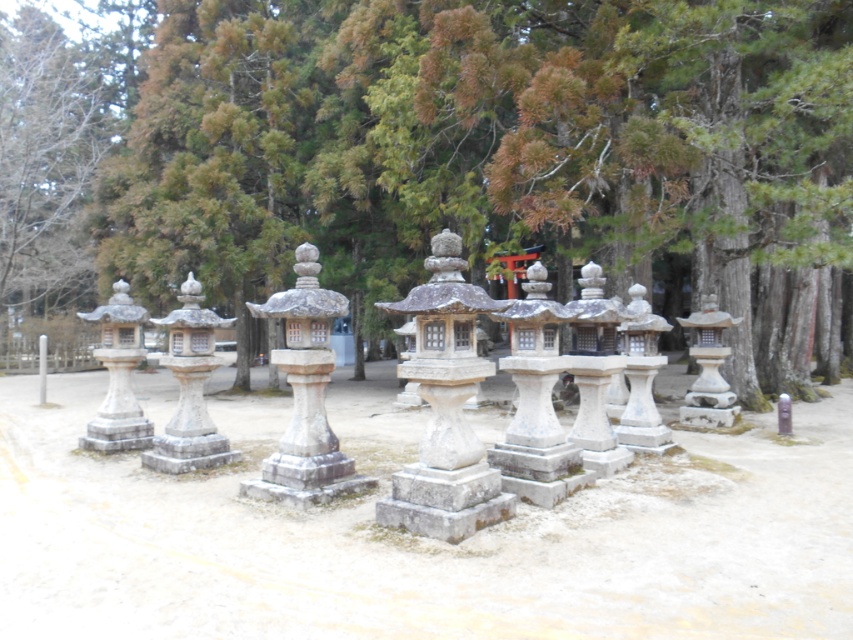
You are standing in front of the row of traditional Japanese stone lanterns. There are two points marked on the ground in front of you at coordinates point (439, 275) and point (199, 291). Which of these two points is closer to you?

Point (439, 275) is closer to the viewer than point (199, 291).

You are standing at the origin point of the coordinate system where the bottom left corner of the image is the origin. The white stone lantern at center is located at coordinates approximately where? Please provide the coordinates as a pair of numbers in parentheses.

The white stone lantern at center is located at coordinates approximately at point (535, 401).